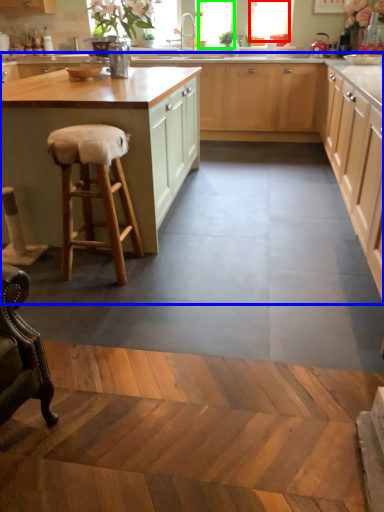
Question: Considering the real-world distances, which object is farthest from window (highlighted by a red box)? cabinetry (highlighted by a blue box) or window screen (highlighted by a green box)?

Choices:
 (A) cabinetry
 (B) window screen

Answer: (A)